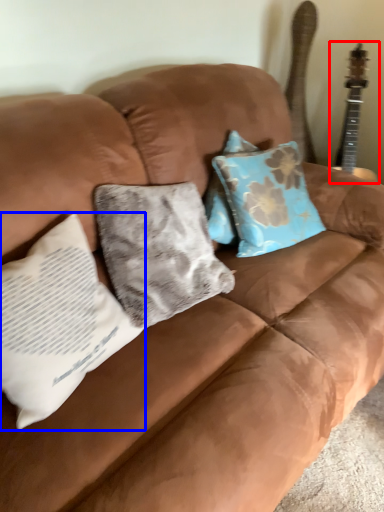
Question: Which object appears closest to the camera in this image, guitar (highlighted by a red box) or pillow (highlighted by a blue box)?

Choices:
 (A) guitar
 (B) pillow

Answer: (B)